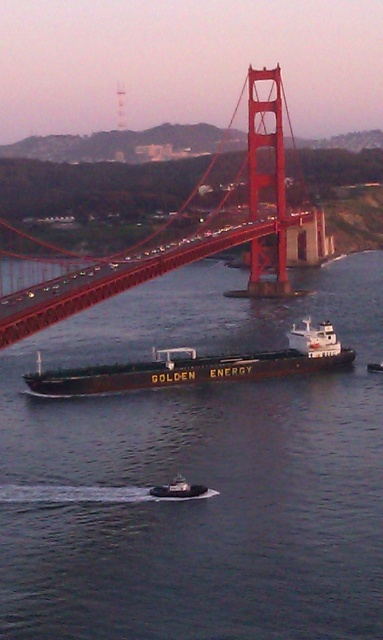
Is red painted steel golden gate bridge at center to the left of metallic gray tugboat at center from the viewer's perspective?

Yes, red painted steel golden gate bridge at center is to the left of metallic gray tugboat at center.

Does point (109, 289) come in front of point (170, 484)?

No.

Between point (302, 216) and point (170, 497), which one is positioned behind?

The point (302, 216) is behind.

Image resolution: width=383 pixels, height=640 pixels. Identify the location of red painted steel golden gate bridge at center. (178, 228).

Between brown matte water at center and red painted steel golden gate bridge at center, which one is positioned higher?

red painted steel golden gate bridge at center is higher up.

Is point (209, 440) behind point (13, 288)?

No, it is in front of (13, 288).

You are a GUI agent. You are given a task and a screenshot of the screen. Output one action in this format:
    pyautogui.click(x=<x>, y=<y>)
    Task: Click on the brown matte water at center
    The image size is (383, 640).
    Given the screenshot: What is the action you would take?
    pyautogui.click(x=198, y=474)

Is point (235, 376) positioned in front of point (181, 492)?

No.

Can you confirm if brown matte cargo ship at center is wider than metallic gray tugboat at center?

Correct, the width of brown matte cargo ship at center exceeds that of metallic gray tugboat at center.

You are a GUI agent. You are given a task and a screenshot of the screen. Output one action in this format:
    pyautogui.click(x=<x>, y=<y>)
    Task: Click on the brown matte cargo ship at center
    
    Given the screenshot: What is the action you would take?
    pyautogui.click(x=199, y=365)